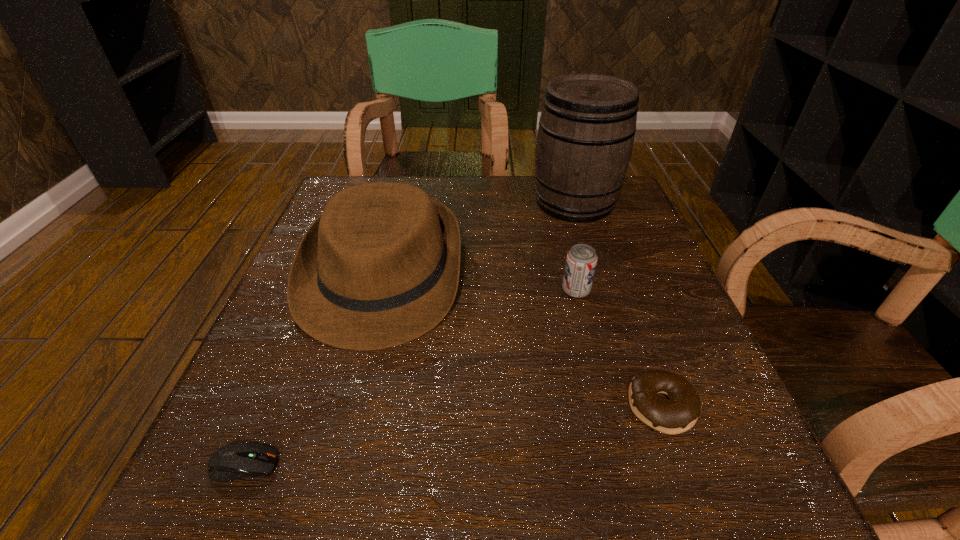
Locate an element on the screen. The width and height of the screenshot is (960, 540). vacant area situated on the left of the doughnut is located at coordinates (420, 406).

Identify the location of free region located on the button of the nearest object. (377, 465).

At what (x,y) coordinates should I click in order to perform the action: click on wine bucket that is at the far edge. Please return your answer as a coordinate pair (x, y). This screenshot has height=540, width=960. Looking at the image, I should click on (585, 138).

I want to click on fedora located at the far edge, so click(x=380, y=267).

Identify the location of object present at the near edge. (234, 461).

Where is `fedora that is at the left edge`? This screenshot has width=960, height=540. fedora that is at the left edge is located at coordinates (380, 267).

Where is `computer equipment located in the left edge section of the desktop`? computer equipment located in the left edge section of the desktop is located at coordinates (234, 461).

In order to click on wine bucket that is positioned at the right edge in this screenshot , I will do `click(585, 138)`.

You are a GUI agent. You are given a task and a screenshot of the screen. Output one action in this format:
    pyautogui.click(x=<x>, y=<y>)
    Task: Click on the beer can that is positioned at the right edge
    Image resolution: width=960 pixels, height=540 pixels.
    Given the screenshot: What is the action you would take?
    pyautogui.click(x=581, y=260)

Locate an element on the screen. doughnut at the right edge is located at coordinates (678, 414).